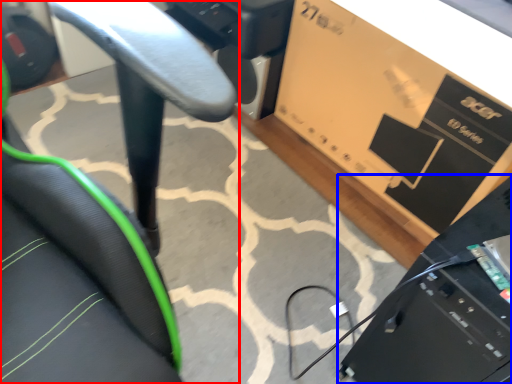
Question: Which object is closer to the camera taking this photo, chair (highlighted by a red box) or computer (highlighted by a blue box)?

Choices:
 (A) chair
 (B) computer

Answer: (B)